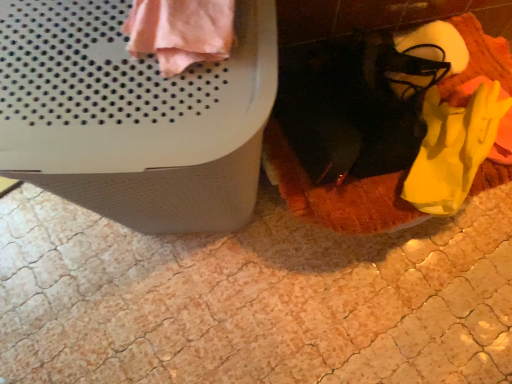
Image resolution: width=512 pixels, height=384 pixels. What do you see at coordinates (338, 194) in the screenshot? I see `soft orange blanket at lower right` at bounding box center [338, 194].

Measure the distance between point (42, 5) and camera.

Point (42, 5) is 22.99 inches away from camera.

Where is `soft orange blanket at lower right`? This screenshot has width=512, height=384. soft orange blanket at lower right is located at coordinates (338, 194).

Considering the relative positions of soft orange blanket at lower right and pink fabric at upper left in the image provided, is soft orange blanket at lower right to the left or to the right of pink fabric at upper left?

In the image, soft orange blanket at lower right appears on the right side of pink fabric at upper left.

Is soft orange blanket at lower right placed right next to pink fabric at upper left?

No, soft orange blanket at lower right is not with pink fabric at upper left.

Is soft orange blanket at lower right in front of or behind pink fabric at upper left in the image?

soft orange blanket at lower right is positioned farther from the viewer than pink fabric at upper left.

Between soft orange blanket at lower right and pink fabric at upper left, which one has less height?

pink fabric at upper left is shorter.

Does pink fabric at upper left come in front of soft orange blanket at lower right?

Yes, pink fabric at upper left is in front of soft orange blanket at lower right.

Consider the image. How different are the orientations of pink fabric at upper left and soft orange blanket at lower right in degrees?

They differ by 1.4 degrees in their facing directions.

This screenshot has width=512, height=384. I want to click on blanket on the right of pink fabric at upper left, so coord(338,194).

Does pink fabric at upper left turn towards soft orange blanket at lower right?

No, pink fabric at upper left is not aimed at soft orange blanket at lower right.

Looking at the image, does yellow fabric shoe at lower right seem bigger or smaller compared to pink fabric at upper left?

Clearly, yellow fabric shoe at lower right is smaller in size than pink fabric at upper left.

Considering the relative sizes of yellow fabric shoe at lower right and pink fabric at upper left in the image provided, is yellow fabric shoe at lower right shorter than pink fabric at upper left?

In fact, yellow fabric shoe at lower right may be taller than pink fabric at upper left.

Identify the location of clothing below the yellow fabric shoe at lower right (from the image's perspective). The height and width of the screenshot is (384, 512). (180, 32).

Could you measure the distance between white textured waste container at upper left and soft orange blanket at lower right?

The distance of white textured waste container at upper left from soft orange blanket at lower right is 15.28 inches.

Could you tell me if white textured waste container at upper left is facing soft orange blanket at lower right?

No, white textured waste container at upper left is not aimed at soft orange blanket at lower right.

Considering the relative sizes of white textured waste container at upper left and soft orange blanket at lower right in the image provided, is white textured waste container at upper left wider than soft orange blanket at lower right?

No, white textured waste container at upper left is not wider than soft orange blanket at lower right.

From a real-world perspective, is white textured waste container at upper left located higher than soft orange blanket at lower right?

Correct, in the physical world, white textured waste container at upper left is higher than soft orange blanket at lower right.

Is white textured waste container at upper left to the left or to the right of yellow fabric shoe at lower right in the image?

From the image, it's evident that white textured waste container at upper left is to the left of yellow fabric shoe at lower right.

Between white textured waste container at upper left and yellow fabric shoe at lower right, which one has less height?

With less height is yellow fabric shoe at lower right.

This screenshot has height=384, width=512. What are the coordinates of `waste container lying on the left of yellow fabric shoe at lower right` in the screenshot? It's located at (134, 116).

Is yellow fabric shoe at lower right spatially inside soft orange blanket at lower right, or outside of it?

yellow fabric shoe at lower right is contained in soft orange blanket at lower right.

Is yellow fabric shoe at lower right placed right next to soft orange blanket at lower right?

No, yellow fabric shoe at lower right is not with soft orange blanket at lower right.

Between yellow fabric shoe at lower right and soft orange blanket at lower right, which one appears on the left side from the viewer's perspective?

soft orange blanket at lower right.

In the image, is yellow fabric shoe at lower right positioned in front of or behind soft orange blanket at lower right?

Clearly, yellow fabric shoe at lower right is behind soft orange blanket at lower right.

From the picture: From the image's perspective, is pink fabric at upper left under white textured waste container at upper left?

Incorrect, from the image's perspective, pink fabric at upper left is higher than white textured waste container at upper left.

Between pink fabric at upper left and white textured waste container at upper left, which one is positioned in front?

white textured waste container at upper left.

At what (x,y) coordinates should I click in order to perform the action: click on blanket below the pink fabric at upper left (from the image's perspective). Please return your answer as a coordinate pair (x, y). The width and height of the screenshot is (512, 384). Looking at the image, I should click on (338, 194).

Where is `clothing located above the soft orange blanket at lower right (from a real-world perspective)`? clothing located above the soft orange blanket at lower right (from a real-world perspective) is located at coordinates (180, 32).

Looking at the image, which one is located closer to soft orange blanket at lower right, white textured waste container at upper left or yellow fabric shoe at lower right?

yellow fabric shoe at lower right is closer to soft orange blanket at lower right.

Considering their positions, is yellow fabric shoe at lower right positioned further to soft orange blanket at lower right than white textured waste container at upper left?

Among the two, white textured waste container at upper left is located further to soft orange blanket at lower right.

Estimate the real-world distances between objects in this image. Which object is further from soft orange blanket at lower right, yellow fabric shoe at lower right or pink fabric at upper left?

Based on the image, pink fabric at upper left appears to be further to soft orange blanket at lower right.

Looking at the image, which one is located closer to white textured waste container at upper left, pink fabric at upper left or yellow fabric shoe at lower right?

pink fabric at upper left lies closer to white textured waste container at upper left than the other object.

From the image, which object appears to be farther from yellow fabric shoe at lower right, soft orange blanket at lower right or pink fabric at upper left?

The object further to yellow fabric shoe at lower right is pink fabric at upper left.

From the image, which object appears to be farther from soft orange blanket at lower right, pink fabric at upper left or white textured waste container at upper left?

pink fabric at upper left is further to soft orange blanket at lower right.

When comparing their distances from white textured waste container at upper left, does soft orange blanket at lower right or pink fabric at upper left seem closer?

pink fabric at upper left lies closer to white textured waste container at upper left than the other object.

Estimate the real-world distances between objects in this image. Which object is closer to white textured waste container at upper left, pink fabric at upper left or soft orange blanket at lower right?

Based on the image, pink fabric at upper left appears to be nearer to white textured waste container at upper left.

You are a GUI agent. You are given a task and a screenshot of the screen. Output one action in this format:
    pyautogui.click(x=<x>, y=<y>)
    Task: Click on the clothing between white textured waste container at upper left and yellow fabric shoe at lower right in the horizontal direction
    The image size is (512, 384).
    Given the screenshot: What is the action you would take?
    pyautogui.click(x=180, y=32)

Locate an element on the screen. This screenshot has height=384, width=512. clothing between white textured waste container at upper left and soft orange blanket at lower right in the horizontal direction is located at coordinates (180, 32).

I want to click on blanket situated between pink fabric at upper left and yellow fabric shoe at lower right from left to right, so click(338, 194).

This screenshot has width=512, height=384. Identify the location of blanket between white textured waste container at upper left and yellow fabric shoe at lower right. (338, 194).